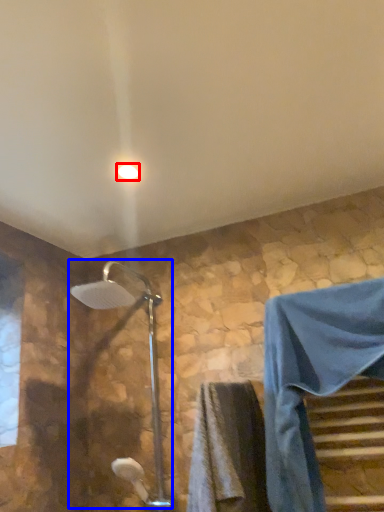
Question: Which of the following is the closest to the observer, light fixture (highlighted by a red box) or shower (highlighted by a blue box)?

Choices:
 (A) light fixture
 (B) shower

Answer: (B)